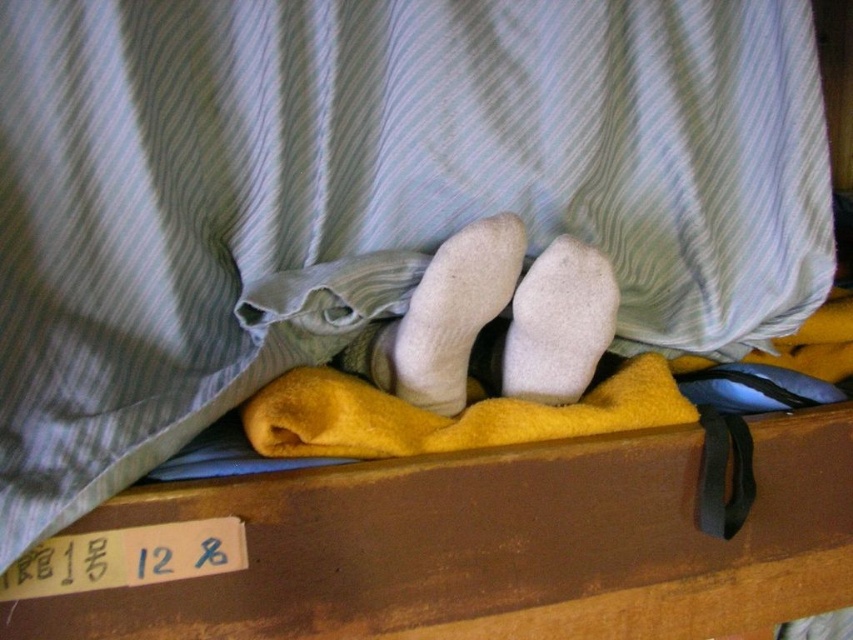
Does point (427, 627) lie behind point (505, 276)?

That is True.

Who is lower down, brown wooden drawer at lower center or white soft socks at center?

brown wooden drawer at lower center

At what (x,y) coordinates should I click in order to perform the action: click on brown wooden drawer at lower center. Please return your answer as a coordinate pair (x, y). The height and width of the screenshot is (640, 853). Looking at the image, I should click on point(494,547).

How distant is brown wooden drawer at lower center from white fuzzy sock at center?

They are 6.47 inches apart.

Does brown wooden drawer at lower center appear over white fuzzy sock at center?

No.

The image size is (853, 640). Identify the location of brown wooden drawer at lower center. (494, 547).

Locate an element on the screen. This screenshot has width=853, height=640. white soft socks at center is located at coordinates (454, 310).

Who is more forward, (469, 307) or (552, 278)?

Positioned in front is point (469, 307).

At what (x,y) coordinates should I click in order to perform the action: click on white soft socks at center. Please return your answer as a coordinate pair (x, y). The image size is (853, 640). Looking at the image, I should click on (454, 310).